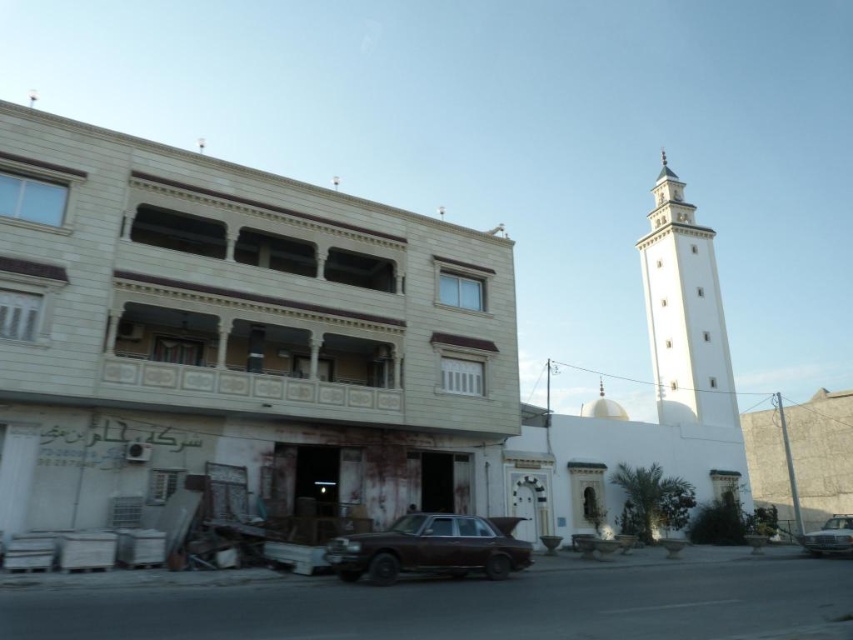
Question: Which is farther from the white marble minaret at upper right?

Choices:
 (A) brown metallic car at center
 (B) brown matte car at center

Answer: (B)

Question: Which point appears farthest from the camera in this image?

Choices:
 (A) (840, 534)
 (B) (474, 532)

Answer: (A)

Question: Among these points, which one is farthest from the camera?

Choices:
 (A) (851, 540)
 (B) (508, 548)

Answer: (A)

Question: Can you confirm if white marble minaret at upper right is positioned to the left of brown matte car at center?

Choices:
 (A) no
 (B) yes

Answer: (A)

Question: Is white marble minaret at upper right to the left of brown metallic car at center from the viewer's perspective?

Choices:
 (A) yes
 (B) no

Answer: (A)

Question: Is brown matte car at center behind brown metallic car at center?

Choices:
 (A) yes
 (B) no

Answer: (B)